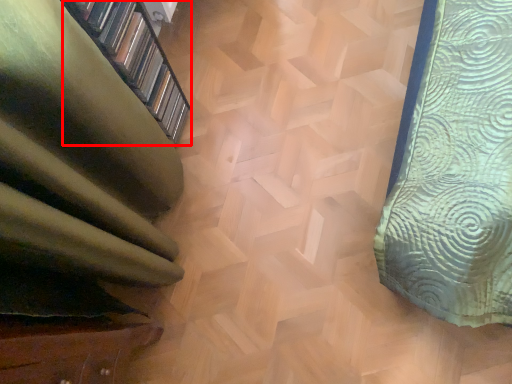
Question: From the image, what is the correct spatial relationship of shelf (annotated by the red box) in relation to stairwell?

Choices:
 (A) left
 (B) right

Answer: (A)